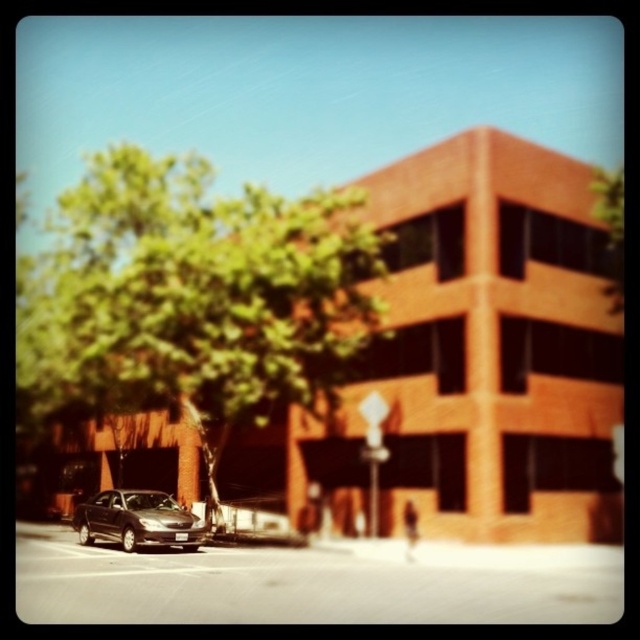
Question: Which object is closer to the camera taking this photo?

Choices:
 (A) green leafy tree at upper left
 (B) shiny dark gray sedan at lower left

Answer: (B)

Question: Which point appears closest to the camera in this image?

Choices:
 (A) (195, 548)
 (B) (289, 317)

Answer: (A)

Question: Observing the image, what is the correct spatial positioning of green leafy tree at upper left in reference to shiny dark gray sedan at lower left?

Choices:
 (A) right
 (B) left

Answer: (B)

Question: Which of the following is the closest to the observer?

Choices:
 (A) (122, 538)
 (B) (173, 209)

Answer: (A)

Question: Does green leafy tree at upper left lie in front of shiny dark gray sedan at lower left?

Choices:
 (A) yes
 (B) no

Answer: (B)

Question: Observing the image, what is the correct spatial positioning of green leafy tree at upper left in reference to shiny dark gray sedan at lower left?

Choices:
 (A) left
 (B) right

Answer: (A)